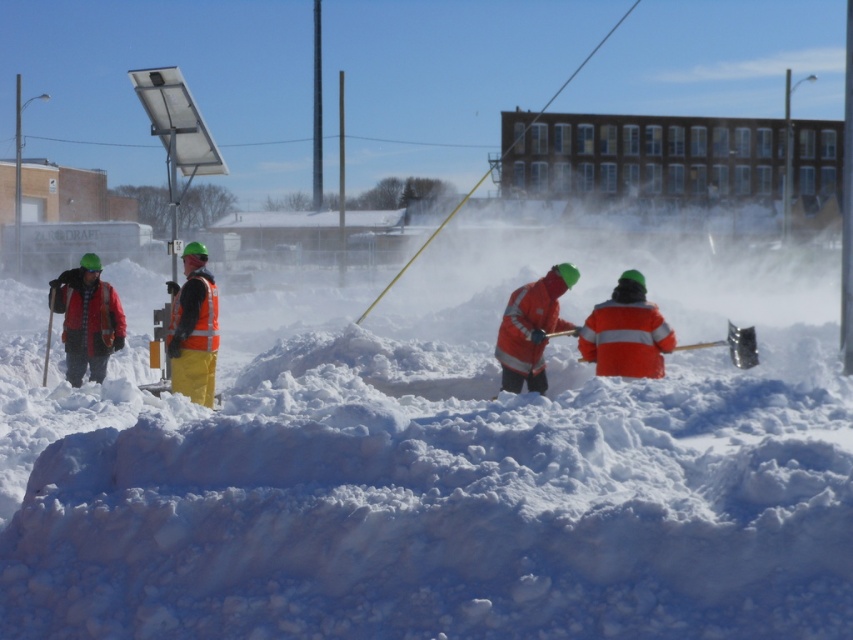
Can you confirm if orange reflective jacket at center is positioned below orange reflective shovel at center?

Incorrect, orange reflective jacket at center is not positioned below orange reflective shovel at center.

Who is shorter, orange reflective jacket at center or orange reflective shovel at center?

orange reflective shovel at center

Which is behind, point (527, 332) or point (548, 333)?

The point (548, 333) is more distant.

Find the location of a particular element. The image size is (853, 640). orange reflective jacket at center is located at coordinates (531, 328).

How distant is orange reflective vest at center from orange reflective jacket at center?

orange reflective vest at center is 2.59 meters from orange reflective jacket at center.

Image resolution: width=853 pixels, height=640 pixels. In order to click on orange reflective vest at center in this screenshot , I will do `click(194, 330)`.

Identify the location of orange reflective vest at center. This screenshot has width=853, height=640. click(194, 330).

Which of these two, orange reflective vest at center or orange reflective shovel at center, stands shorter?

With less height is orange reflective shovel at center.

Is orange reflective vest at center below orange reflective shovel at center?

No.

Who is more forward, [183,305] or [733,333]?

Positioned in front is point [733,333].

The height and width of the screenshot is (640, 853). I want to click on orange reflective vest at center, so click(194, 330).